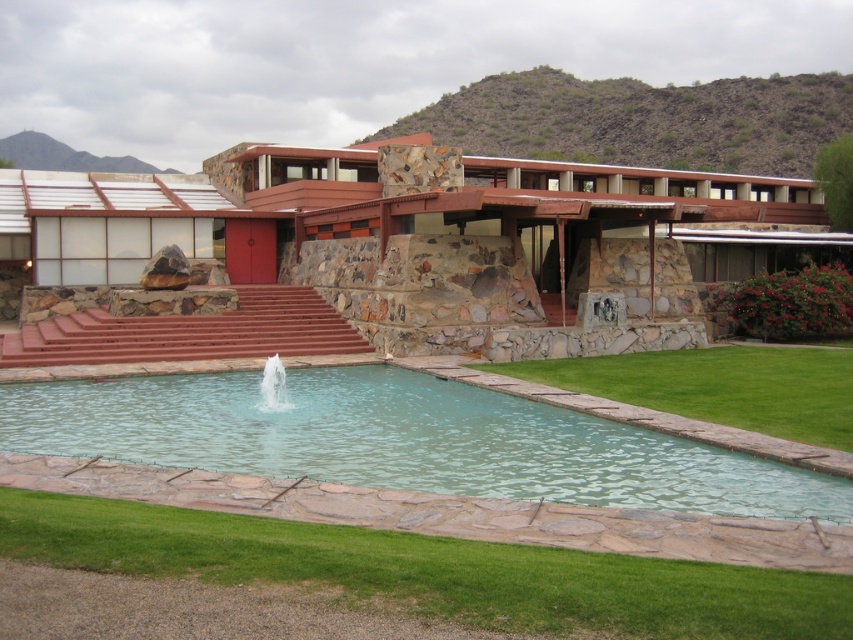
Which is more to the right, clear glass pool at center or clear glass water at center?

From the viewer's perspective, clear glass pool at center appears more on the right side.

The height and width of the screenshot is (640, 853). Describe the element at coordinates (405, 442) in the screenshot. I see `clear glass pool at center` at that location.

This screenshot has width=853, height=640. What are the coordinates of `clear glass pool at center` in the screenshot? It's located at point(405,442).

Is clear glass pool at center further to camera compared to green grass at lower right?

No, it is not.

Which is in front, point (762, 468) or point (758, 372)?

Point (762, 468) is more forward.

Is point (3, 387) behind point (601, 362)?

No, it is not.

Where is `clear glass pool at center`? The height and width of the screenshot is (640, 853). clear glass pool at center is located at coordinates (405, 442).

Is green grass at lower right above clear glass water at center?

Indeed, green grass at lower right is positioned over clear glass water at center.

Which of these two, green grass at lower right or clear glass water at center, stands shorter?

With less height is clear glass water at center.

The image size is (853, 640). I want to click on green grass at lower right, so click(718, 387).

At what (x,y) coordinates should I click in order to perform the action: click on green grass at lower right. Please return your answer as a coordinate pair (x, y). The image size is (853, 640). Looking at the image, I should click on (718, 387).